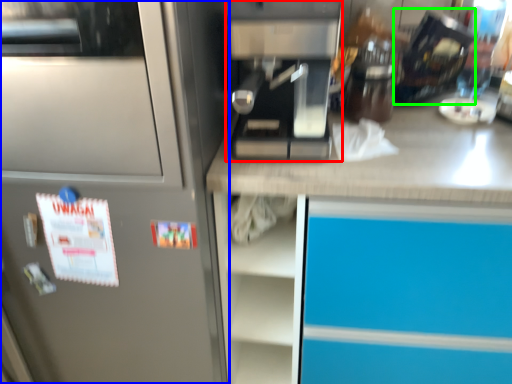
Question: Which object is positioned closest to kitchen appliance (highlighted by a red box)? Select from home appliance (highlighted by a blue box) and appliance (highlighted by a green box).

Choices:
 (A) home appliance
 (B) appliance

Answer: (A)